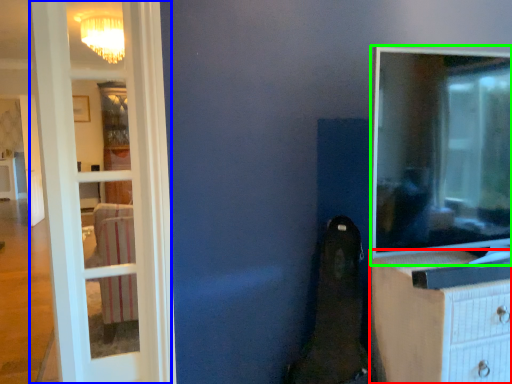
Question: Which is nearer to the chest of drawers (highlighted by a red box)? door (highlighted by a blue box) or tv show (highlighted by a green box).

Choices:
 (A) door
 (B) tv show

Answer: (B)